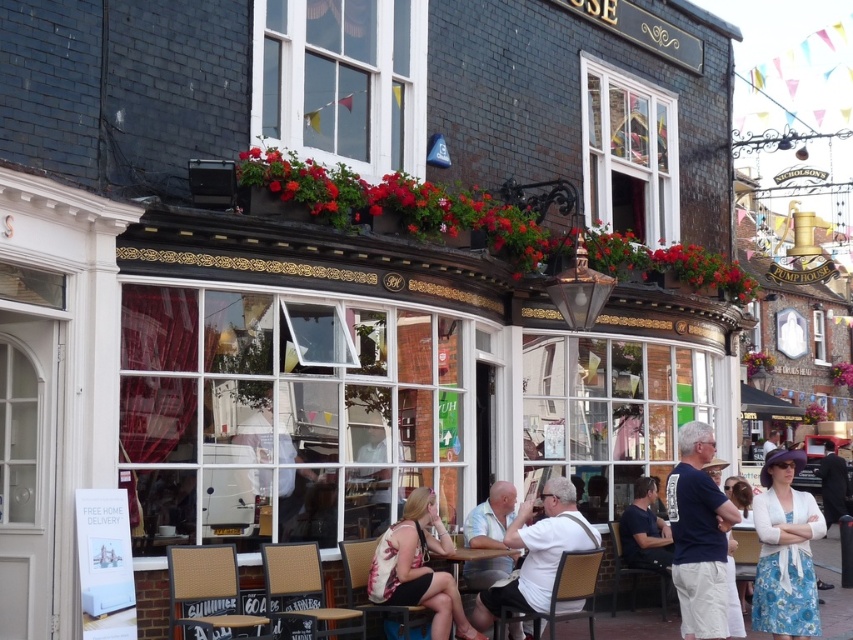
Question: Does floral fabric dress at center have a greater width compared to white fabric shirt at center?

Choices:
 (A) yes
 (B) no

Answer: (A)

Question: Which of these objects is positioned farthest from the floral fabric dress at lower right?

Choices:
 (A) wooden table at center
 (B) white fabric shirt at center
 (C) light blue shirt at center

Answer: (B)

Question: Which of the following is the farthest from the observer?

Choices:
 (A) (712, 548)
 (B) (448, 566)
 (C) (497, 563)
 (D) (554, 518)

Answer: (C)

Question: Is white fabric shirt at center to the left of light blue shirt at center from the viewer's perspective?

Choices:
 (A) no
 (B) yes

Answer: (A)

Question: Which object is positioned farthest from the wooden table at center?

Choices:
 (A) floral fabric dress at center
 (B) blue cotton t-shirt at center-right

Answer: (B)

Question: Is light blue shirt at center to the right of wooden table at center from the viewer's perspective?

Choices:
 (A) yes
 (B) no

Answer: (A)